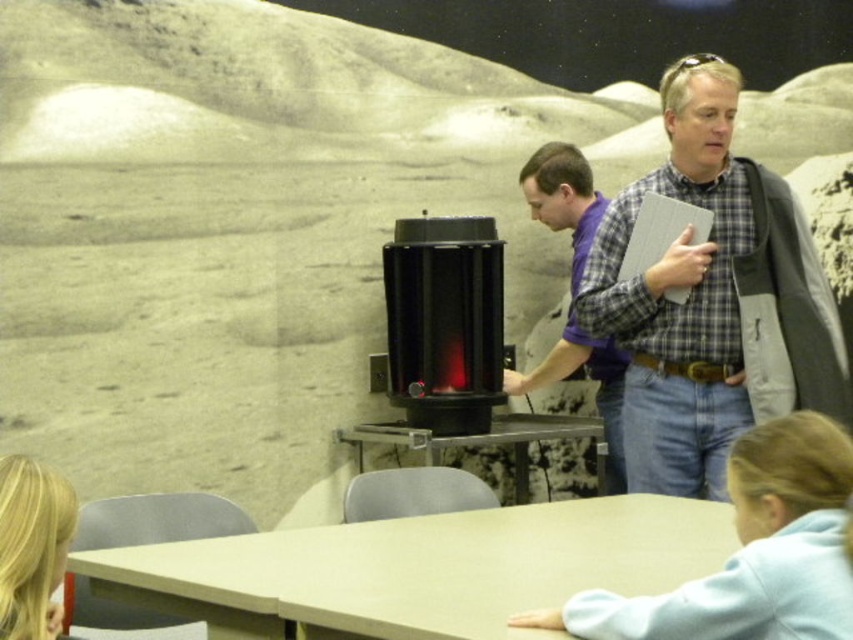
Question: Does purple plaid shirt at center have a greater width compared to blonde hair at lower left?

Choices:
 (A) no
 (B) yes

Answer: (B)

Question: Which object is the farthest from the purple plaid shirt at center?

Choices:
 (A) smooth gray table at center
 (B) plaid shirt at upper right

Answer: (B)

Question: Which point is farther from the camera taking this photo?

Choices:
 (A) (415, 428)
 (B) (538, 378)
 (C) (759, 589)
 (D) (0, 556)

Answer: (B)

Question: Based on their relative distances, which object is farther from the light blue fleece at lower right?

Choices:
 (A) smooth gray table at center
 (B) purple plaid shirt at center
 (C) light brown wooden table at center
 (D) blonde hair at lower left

Answer: (B)

Question: Is plaid shirt at upper right positioned behind light brown wooden table at center?

Choices:
 (A) yes
 (B) no

Answer: (A)

Question: Does light blue fleece at lower right have a greater width compared to blonde hair at lower left?

Choices:
 (A) yes
 (B) no

Answer: (A)